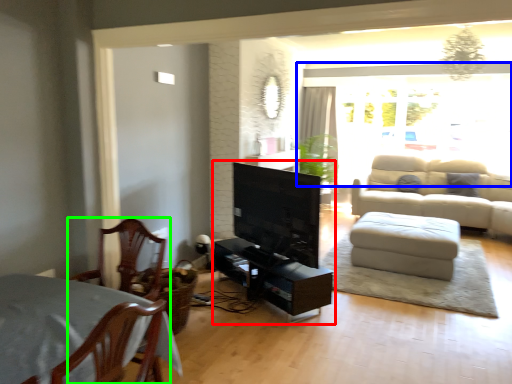
Question: Considering the real-world distances, which object is farthest from entertainment center (highlighted by a red box)? window (highlighted by a blue box) or chair (highlighted by a green box)?

Choices:
 (A) window
 (B) chair

Answer: (A)